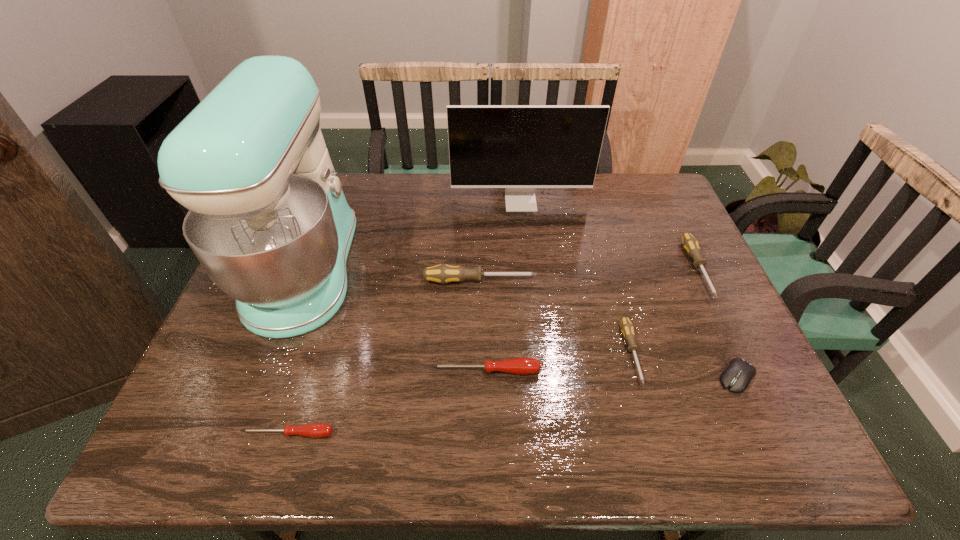
Identify the location of gray screwdriver that stands as the second closest to the third tallest object. This screenshot has width=960, height=540. (690, 244).

Choose which gray screwdriver is the nearest neighbor to the tallest object. Please provide its 2D coordinates. Your answer should be formatted as a tuple, i.e. [(x, y)], where the tuple contains the x and y coordinates of a point satisfying the conditions above.

[(443, 273)]

I want to click on blank area in the image that satisfies the following two spatial constraints: 1. on the front side of the farther red screwdriver; 2. on the right side of the computer equipment, so click(x=486, y=377).

Find the location of `free space that satisfies the following two spatial constraints: 1. on the front-facing side of the black monitor; 2. at the base of the light mixer`. free space that satisfies the following two spatial constraints: 1. on the front-facing side of the black monitor; 2. at the base of the light mixer is located at coordinates (528, 269).

This screenshot has width=960, height=540. What are the coordinates of `free spot that satisfies the following two spatial constraints: 1. on the back side of the computer equipment; 2. at the tip of the biggest gray screwdriver` in the screenshot? It's located at (692, 281).

You are a GUI agent. You are given a task and a screenshot of the screen. Output one action in this format:
    pyautogui.click(x=<x>, y=<y>)
    Task: Click on the vacant area in the image that satisfies the following two spatial constraints: 1. on the front-facing side of the black monitor; 2. at the base of the light mixer
    The height and width of the screenshot is (540, 960).
    Given the screenshot: What is the action you would take?
    pyautogui.click(x=528, y=269)

Image resolution: width=960 pixels, height=540 pixels. What are the coordinates of `free space in the image that satisfies the following two spatial constraints: 1. at the base of the light mixer; 2. on the back side of the smaller red screwdriver` in the screenshot? It's located at (242, 434).

Identify the location of blank space that satisfies the following two spatial constraints: 1. at the tip of the second smallest gray screwdriver; 2. at the tip of the leftmost gray screwdriver. The image size is (960, 540). (703, 281).